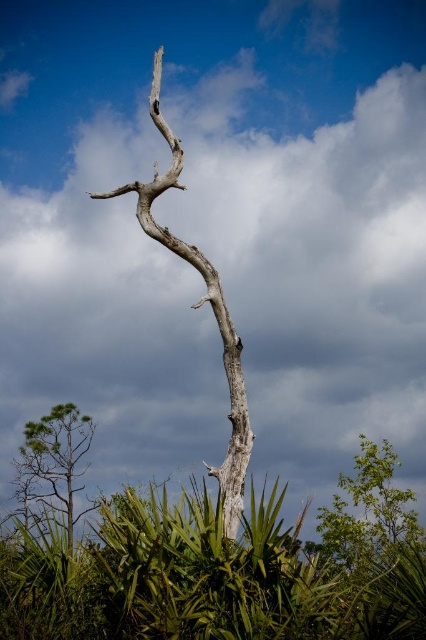
Question: Is gray textured branch at center thinner than green leafy tree at lower right?

Choices:
 (A) no
 (B) yes

Answer: (B)

Question: Among these objects, which one is farthest from the camera?

Choices:
 (A) gray textured branch at center
 (B) green leafy tree at lower left

Answer: (B)

Question: Is gray textured branch at center bigger than green leafy tree at lower right?

Choices:
 (A) no
 (B) yes

Answer: (A)

Question: Based on their relative distances, which object is farther from the gray textured branch at center?

Choices:
 (A) green leafy tree at lower left
 (B) green leafy tree at lower right

Answer: (A)

Question: Estimate the real-world distances between objects in this image. Which object is closer to the green leafy tree at lower right?

Choices:
 (A) green leafy tree at lower left
 (B) gray textured branch at center

Answer: (B)

Question: Does gray textured branch at center appear on the right side of green leafy tree at lower left?

Choices:
 (A) no
 (B) yes

Answer: (B)